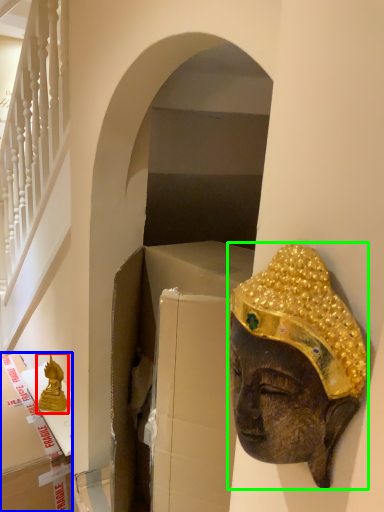
Question: Which object is the closest to the statue (highlighted by a red box)? Choose among these: cardboard box (highlighted by a blue box) or person (highlighted by a green box).

Choices:
 (A) cardboard box
 (B) person

Answer: (A)